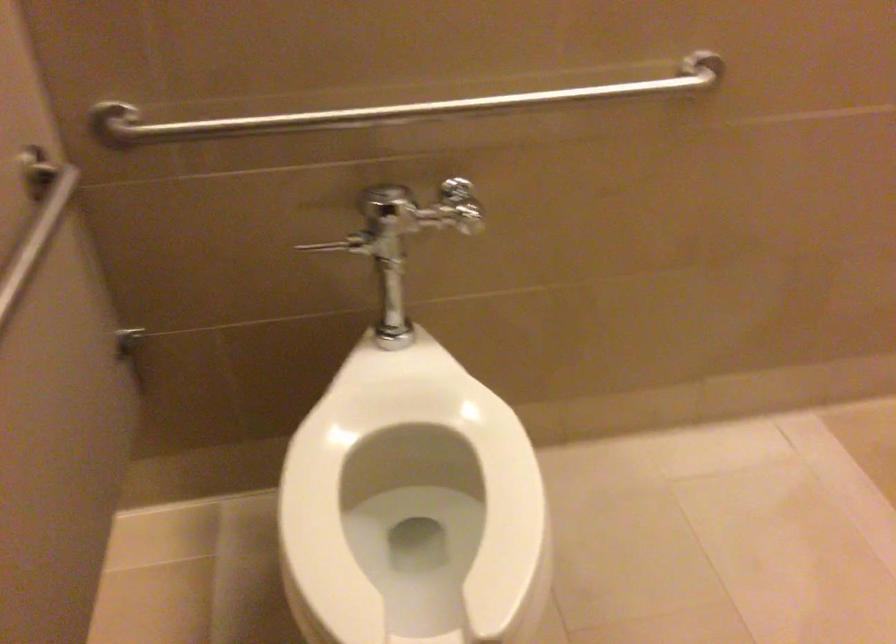
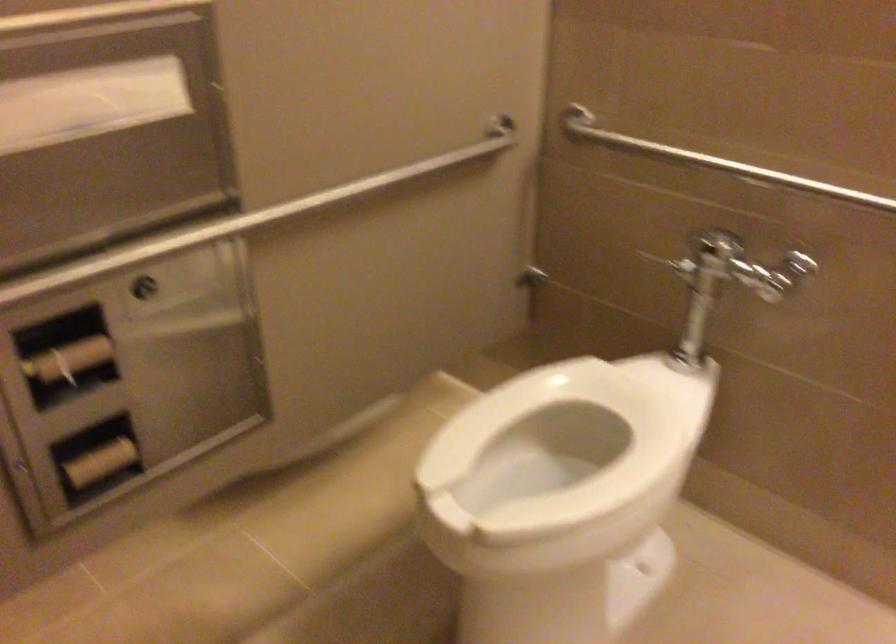
In the second image, find the point that corresponds to [341,480] in the first image.

(563, 431)